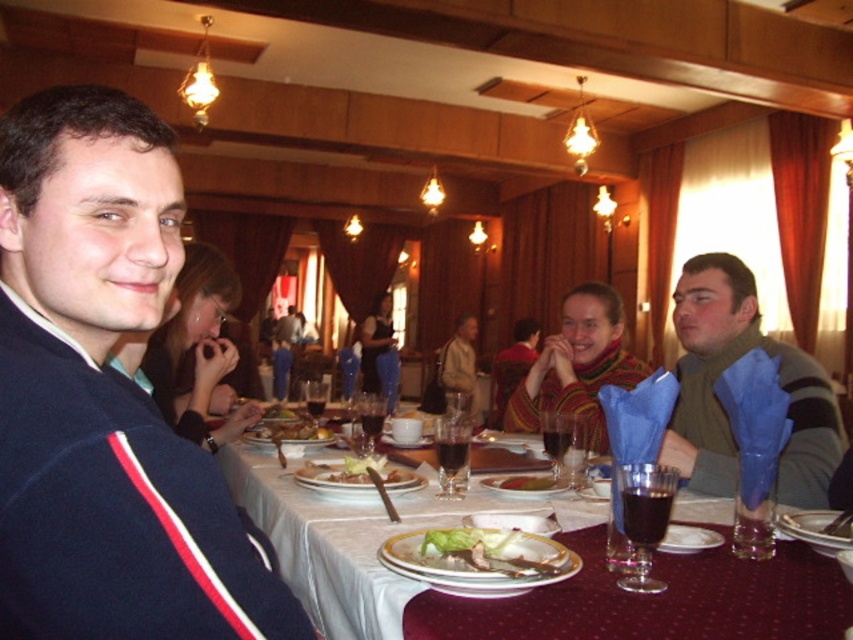
In the scene shown: You are a photographer standing at the camera position. You want to focus on both point (94, 582) and point (288, 422) in the image. Which point should you adjust your focus to first to ensure the closest one is sharp?

Point (94, 582) is closer to the camera than point (288, 422), so you should focus on point (94, 582) first to ensure it is sharp before adjusting for the other point.

You are a server in the restaurant and need to place a new dessert plate on the table. Considering the height of the maroon fabric table at center and the white porcelain plate at center, will the dessert plate fit on top of the table without hanging over the edge?

The maroon fabric table at center has a greater height compared to the white porcelain plate at center, so the dessert plate will fit on top of the maroon fabric table at center without hanging over the edge since the table is taller than the plate.